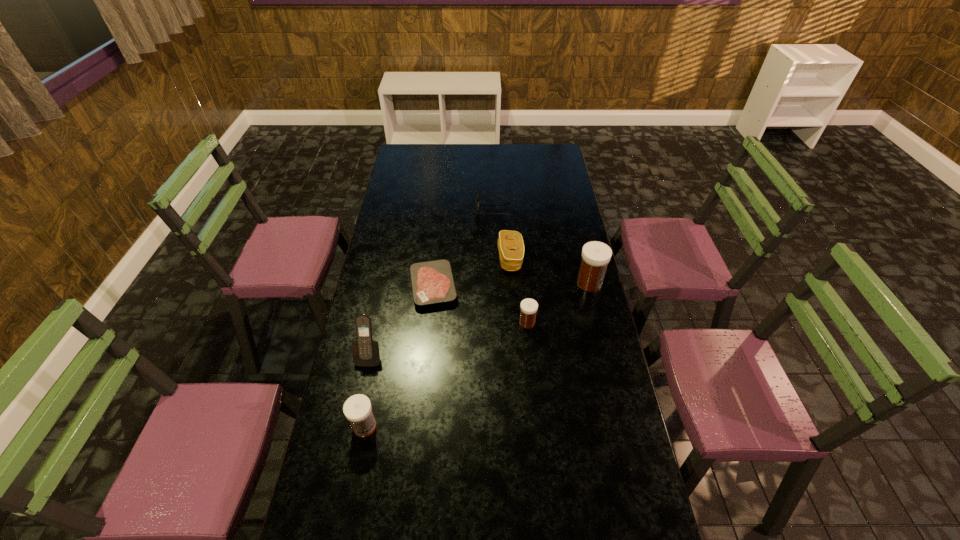
The width and height of the screenshot is (960, 540). Find the location of `free space at the near left corner`. free space at the near left corner is located at coordinates (327, 496).

You are a GUI agent. You are given a task and a screenshot of the screen. Output one action in this format:
    pyautogui.click(x=<x>, y=<y>)
    Task: Click on the unoccupied area between the fifth farthest object and the rightmost medicine
    Image resolution: width=960 pixels, height=540 pixels.
    Given the screenshot: What is the action you would take?
    pyautogui.click(x=558, y=303)

Locate an element on the screen. vacant point located between the fifth farthest object and the tallest medicine is located at coordinates (558, 303).

Image resolution: width=960 pixels, height=540 pixels. What are the coordinates of `empty location between the leftmost medicine and the rightmost object` in the screenshot? It's located at (477, 355).

Find the location of a particular element. The height and width of the screenshot is (540, 960). vacant area that lies between the second shortest object and the third object from left to right is located at coordinates (464, 248).

You are a GUI agent. You are given a task and a screenshot of the screen. Output one action in this format:
    pyautogui.click(x=<x>, y=<y>)
    Task: Click on the vacant space that is in between the steak and the nearest object
    The image size is (960, 540).
    Given the screenshot: What is the action you would take?
    pyautogui.click(x=399, y=356)

Where is `vacant area that lies between the third object from left to right and the second shortest object`? The image size is (960, 540). vacant area that lies between the third object from left to right and the second shortest object is located at coordinates [x=464, y=248].

Where is `free spot between the second shortest medicine and the third nearest object`? free spot between the second shortest medicine and the third nearest object is located at coordinates (446, 374).

You are a GUI agent. You are given a task and a screenshot of the screen. Output one action in this format:
    pyautogui.click(x=<x>, y=<y>)
    Task: Click on the empty space between the clutch bag and the nearest medicine
    
    Given the screenshot: What is the action you would take?
    pyautogui.click(x=438, y=342)

This screenshot has width=960, height=540. I want to click on vacant point located between the tallest medicine and the cellular telephone, so click(479, 319).